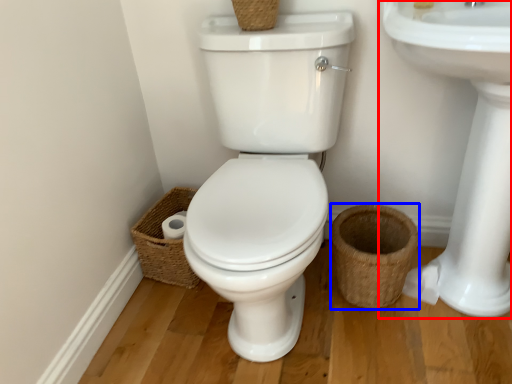
Question: Which object appears farthest to the camera in this image, sink (highlighted by a red box) or basket (highlighted by a blue box)?

Choices:
 (A) sink
 (B) basket

Answer: (B)